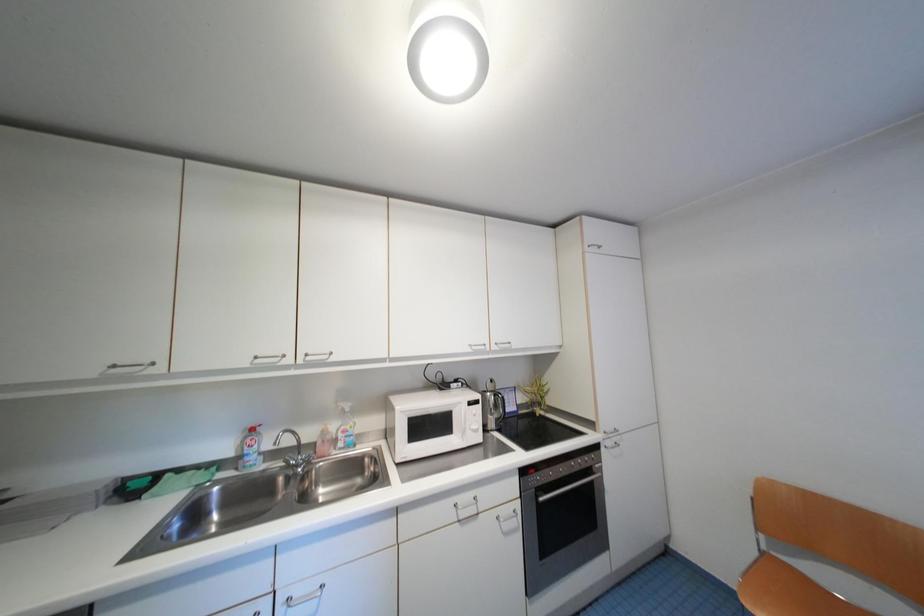
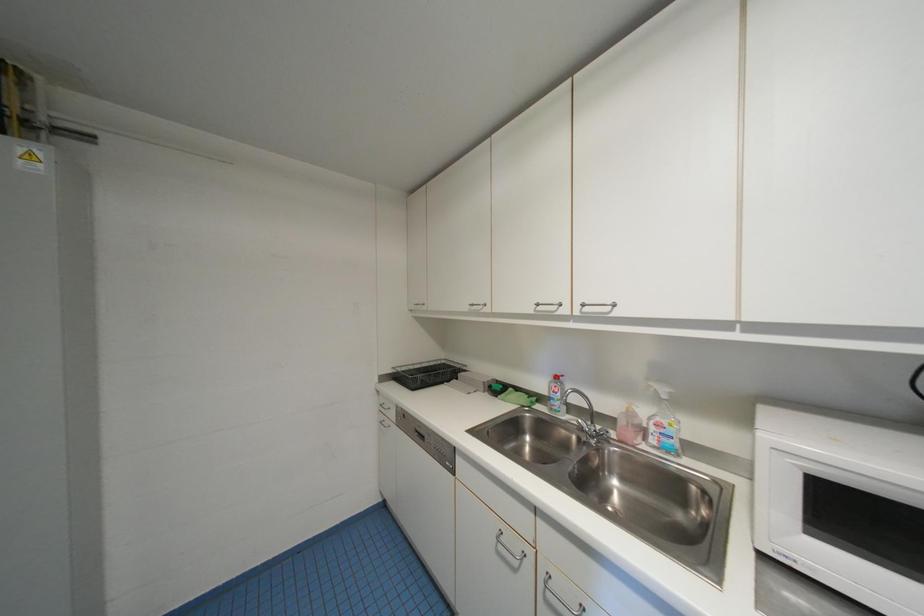
Question: The camera is either moving clockwise (left) or counter-clockwise (right) around the object. The first image is from the beginning of the video and the second image is from the end. Is the camera moving left or right when shooting the video?

Choices:
 (A) Left
 (B) Right

Answer: (B)